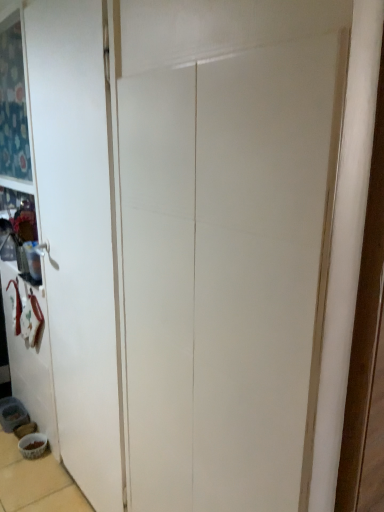
Question: Is white matte door at left completely or partially outside of white glossy bowl at lower left?

Choices:
 (A) no
 (B) yes

Answer: (B)

Question: Is white matte door at left positioned with its back to white glossy bowl at lower left?

Choices:
 (A) no
 (B) yes

Answer: (A)

Question: From a real-world perspective, does white matte door at left stand above white glossy bowl at lower left?

Choices:
 (A) yes
 (B) no

Answer: (A)

Question: Considering the relative sizes of white matte door at left and white glossy bowl at lower left in the image provided, is white matte door at left taller than white glossy bowl at lower left?

Choices:
 (A) no
 (B) yes

Answer: (B)

Question: Considering the relative sizes of white matte door at left and white glossy bowl at lower left in the image provided, is white matte door at left smaller than white glossy bowl at lower left?

Choices:
 (A) yes
 (B) no

Answer: (B)

Question: From the image's perspective, is white matte door at left over white glossy bowl at lower left?

Choices:
 (A) no
 (B) yes

Answer: (B)

Question: Is the position of white glossy bowl at lower left less distant than that of white matte door at left?

Choices:
 (A) no
 (B) yes

Answer: (A)

Question: Is white glossy bowl at lower left facing towards white matte door at left?

Choices:
 (A) yes
 (B) no

Answer: (B)

Question: Is white glossy bowl at lower left located outside white matte door at left?

Choices:
 (A) yes
 (B) no

Answer: (A)

Question: Considering the relative sizes of white glossy bowl at lower left and white matte door at left in the image provided, is white glossy bowl at lower left thinner than white matte door at left?

Choices:
 (A) yes
 (B) no

Answer: (B)

Question: Can you confirm if white glossy bowl at lower left is positioned to the right of white matte door at left?

Choices:
 (A) yes
 (B) no

Answer: (B)

Question: Are white glossy bowl at lower left and white matte door at left making contact?

Choices:
 (A) no
 (B) yes

Answer: (A)

Question: Based on their positions, is white glossy bowl at lower left located to the left or right of white matte door at left?

Choices:
 (A) right
 (B) left

Answer: (B)